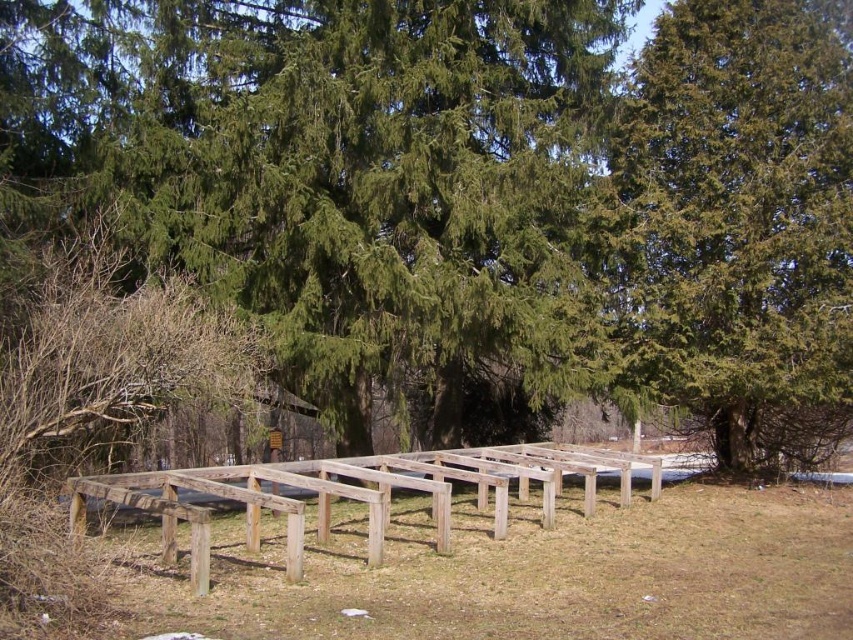
You are an architect designing a new outdoor structure. You need to ensure that the green textured tree at upper right and the weathered wood frame at center are visible from the main entrance. Given their sizes, which object might require strategic placement to avoid blocking the view of the other?

The green textured tree at upper right has a smaller size compared to the weathered wood frame at center. To ensure both are visible from the main entrance, the weathered wood frame at center may need to be positioned so that its larger size does not obstruct the view of the smaller green textured tree at upper right.

You are standing at the center of the partially constructed wooden framework. Looking towards the green textured tree at upper right, in which direction should you walk to face it?

The green textured tree at upper right is located at coordinates 0.352 on the x axis and 0.869 on the y axis. Since you are at the center, you should walk towards the upper right direction to face it.

From the picture: You are an architect examining the outdoor scene. You need to determine the spatial relationship between the weathered wood frame at center and the green textured tree at upper right. Which object is closer to the observer?

The green textured tree at upper right is closer to the observer because the weathered wood frame at center is behind it.